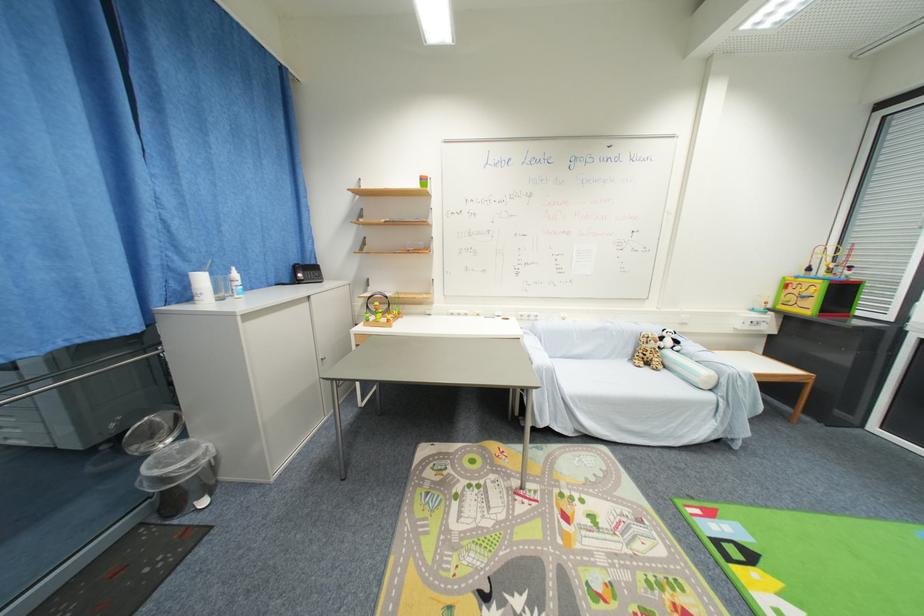
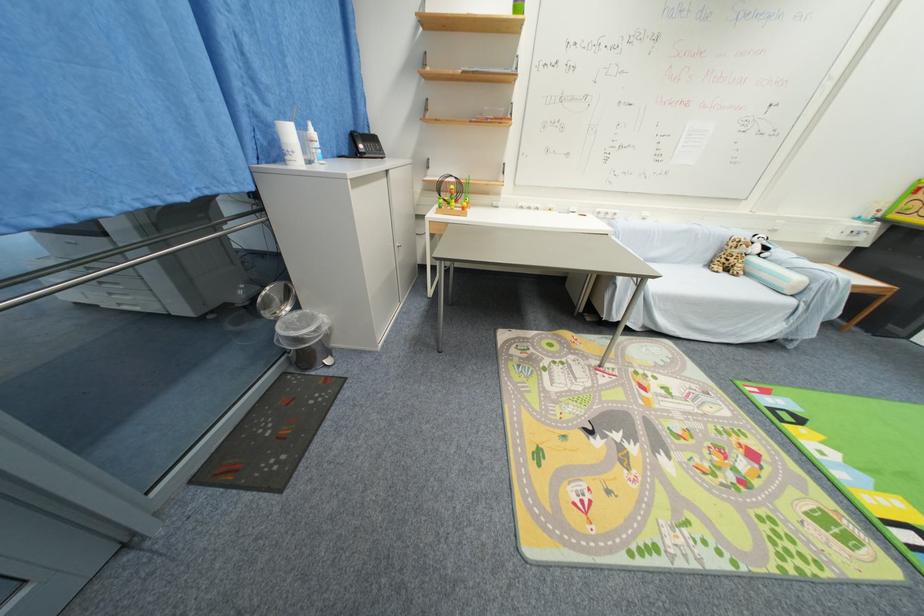
Locate, in the second image, the point that corresponds to (651,371) in the first image.

(730, 276)